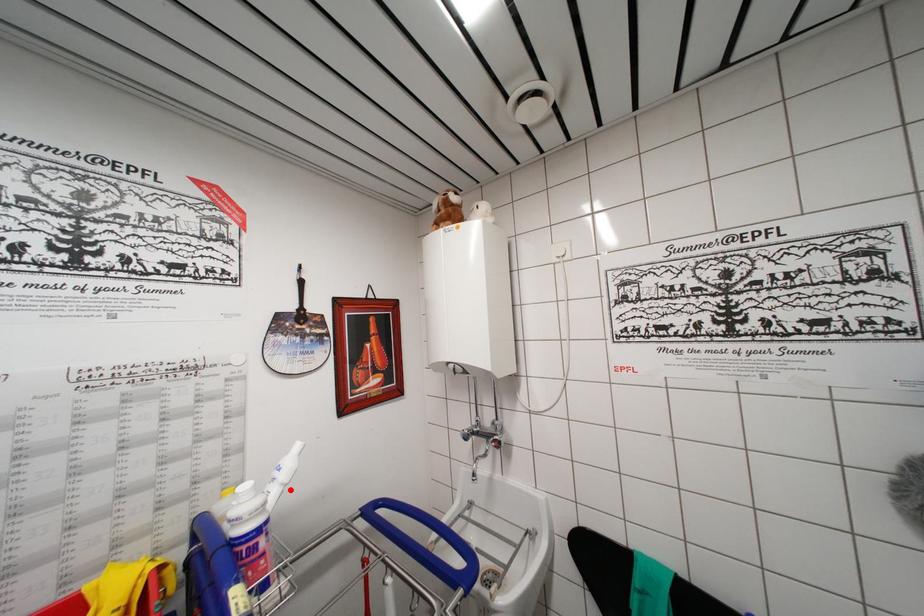
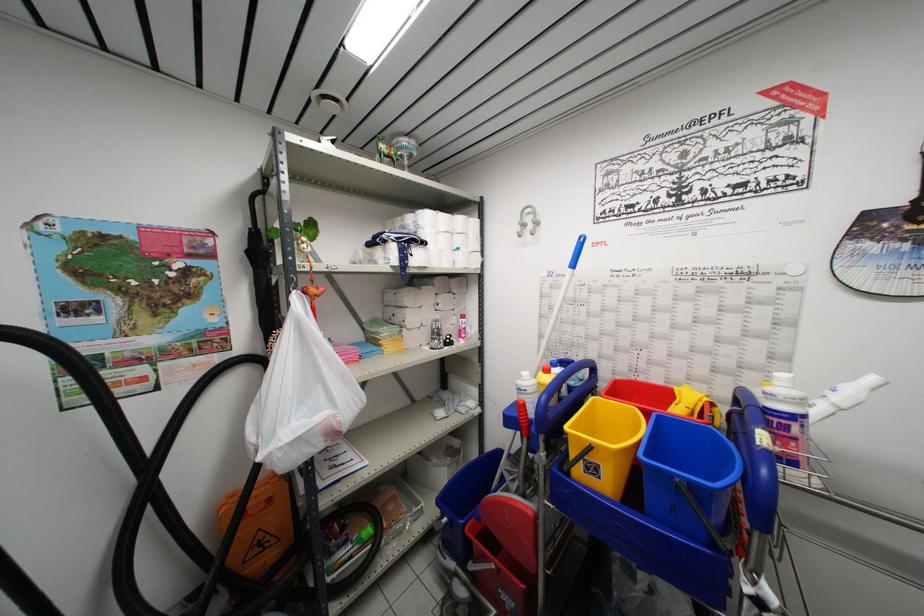
The point at the highlighted location is marked in the first image. Where is the corresponding point in the second image?

(845, 415)